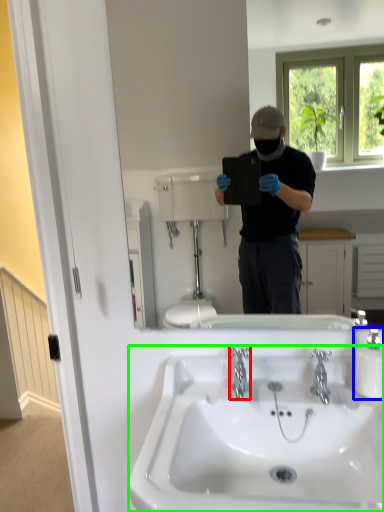
Question: Which object is the closest to the plumbing fixture (highlighted by a red box)? Choose among these: bottle (highlighted by a blue box) or sink (highlighted by a green box).

Choices:
 (A) bottle
 (B) sink

Answer: (B)